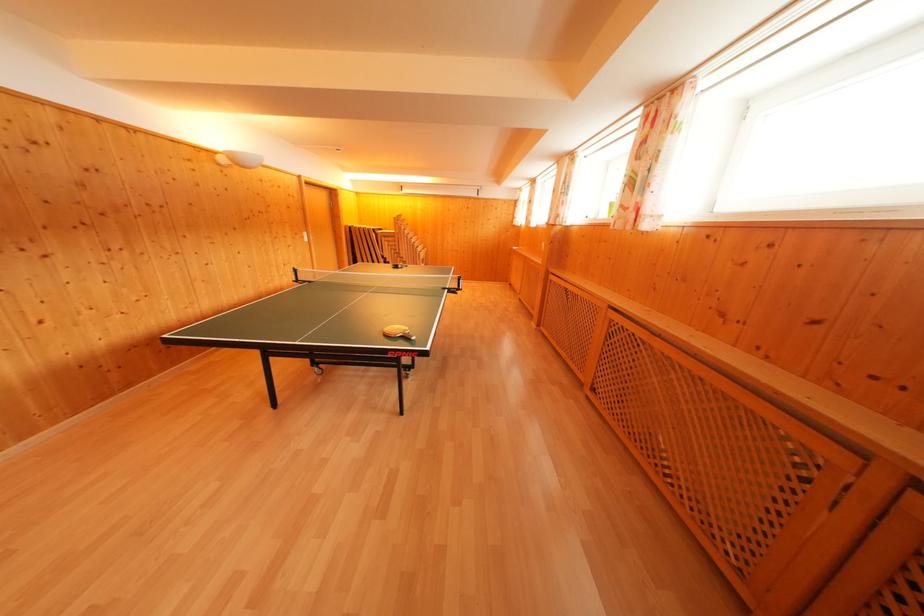
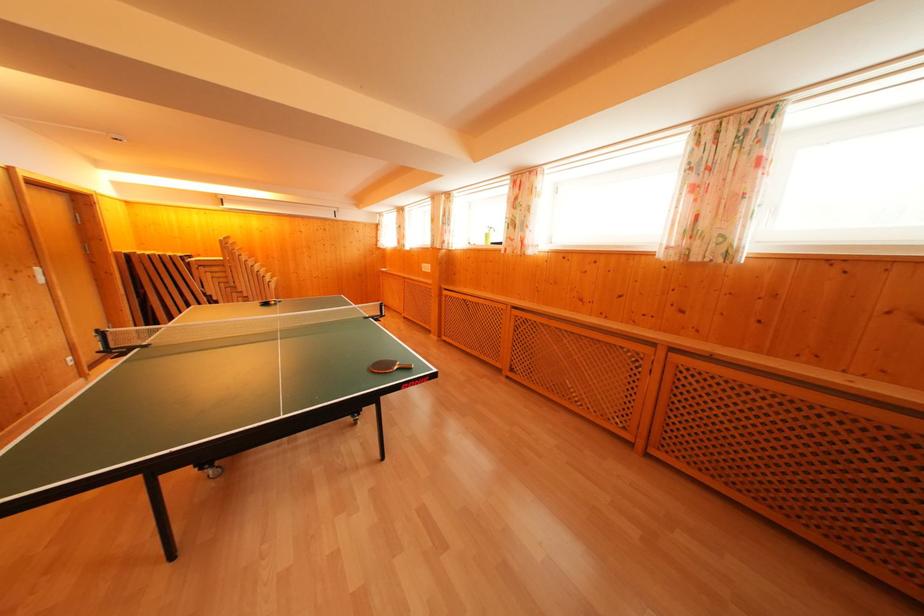
Question: How did the camera likely rotate?

Choices:
 (A) Left
 (B) Right
 (C) Up
 (D) Down

Answer: (B)